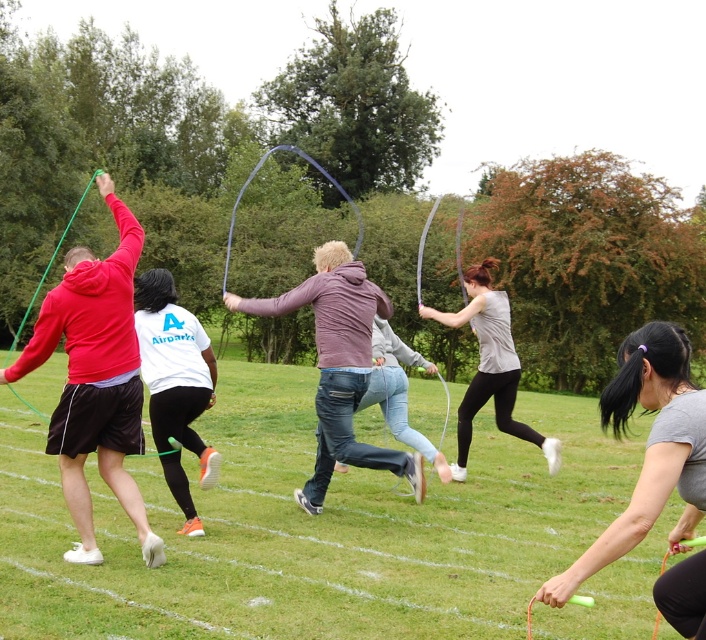
You are a photographer trying to capture a group photo of the matte red hoodie at left and the matte gray hoodie at center. Since you want both subjects to appear equally tall in the photo, which subject should you position closer to the camera?

To make both the matte red hoodie at left and the matte gray hoodie at center appear equally tall in the photo, you should position the matte red hoodie at left closer to the camera because it is shorter in reality. This adjustment will help balance their sizes in the frame.

You are standing at the camera position and want to throw a ball to the matte red hoodie at left. Is the distance within a typical adult male throwing range of 15 meters?

The distance between the matte red hoodie at left and the camera is 4.92 meters, which is well within the typical adult male throwing range of 15 meters.